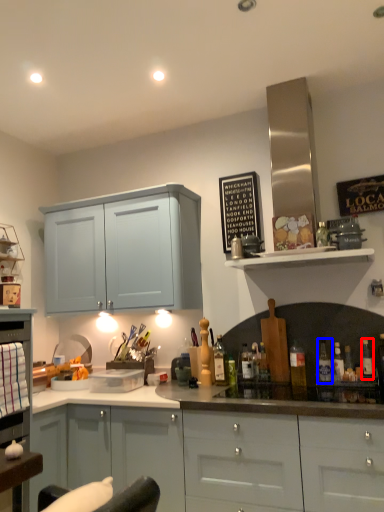
Question: Which object appears farthest to the camera in this image, bottle (highlighted by a red box) or bottle (highlighted by a blue box)?

Choices:
 (A) bottle
 (B) bottle

Answer: (B)